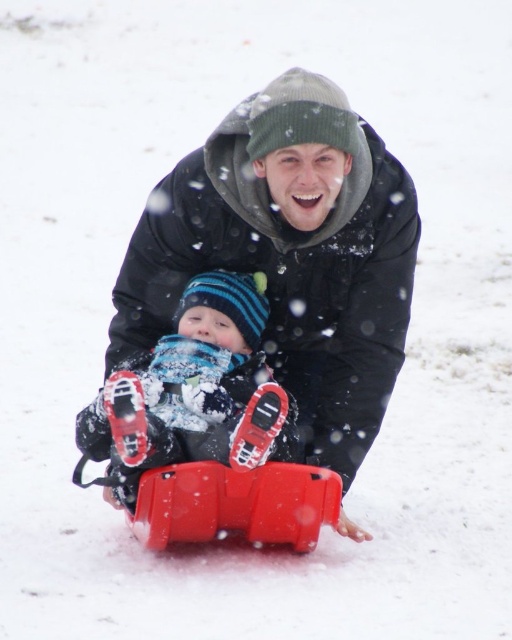
Which is more to the left, matte black jacket at center or matte plastic sled at center?

matte plastic sled at center

Is point (250, 253) positioned after point (185, 451)?

Yes, it is behind point (185, 451).

Find the location of a particular element. The image size is (512, 640). matte black jacket at center is located at coordinates point(289,253).